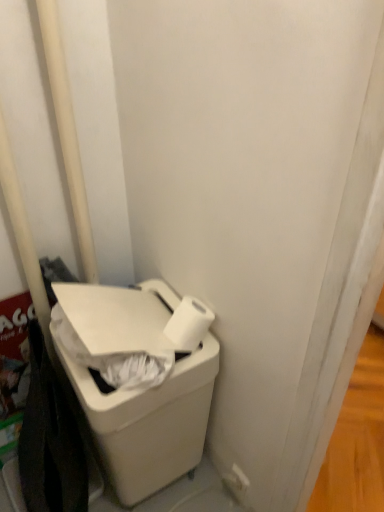
The image size is (384, 512). Find the location of `white matte toilet paper at lower right`. white matte toilet paper at lower right is located at coordinates (189, 324).

This screenshot has width=384, height=512. Describe the element at coordinates (138, 386) in the screenshot. I see `white plastic waste container at lower left` at that location.

This screenshot has width=384, height=512. Identify the location of white matte toilet paper at lower right. (189, 324).

Do you think white matte toilet paper at lower right is within white plastic pole at left, or outside of it?

white matte toilet paper at lower right is not enclosed by white plastic pole at left.

Considering the relative sizes of white matte toilet paper at lower right and white plastic pole at left in the image provided, is white matte toilet paper at lower right bigger than white plastic pole at left?

No.

Between point (174, 325) and point (68, 153), which one is positioned behind?

The point (68, 153) is more distant.

Is white matte toilet paper at lower right aimed at white plastic pole at left?

No, white matte toilet paper at lower right is not aimed at white plastic pole at left.

Looking at the image, does white plastic pole at left seem bigger or smaller compared to white plastic waste container at lower left?

white plastic pole at left is smaller than white plastic waste container at lower left.

Does point (73, 140) appear closer or farther from the camera than point (183, 367)?

Point (73, 140) is farther from the camera than point (183, 367).

Considering the sizes of white plastic pole at left and white plastic waste container at lower left in the image, is white plastic pole at left wider or thinner than white plastic waste container at lower left?

In the image, white plastic pole at left appears to be more narrow than white plastic waste container at lower left.

From the image's perspective, is white plastic pole at left located above or below white plastic waste container at lower left?

white plastic pole at left is situated higher than white plastic waste container at lower left in the image.

From a real-world perspective, who is located higher, white plastic waste container at lower left or white plastic pole at left?

white plastic pole at left, from a real-world perspective.

How many degrees apart are the facing directions of white plastic waste container at lower left and white plastic pole at left?

The angular difference between white plastic waste container at lower left and white plastic pole at left is 90 degrees.

From the image's perspective, is white plastic waste container at lower left positioned above or below white plastic pole at left?

Clearly, from the image's perspective, white plastic waste container at lower left is below white plastic pole at left.

Can you confirm if white plastic waste container at lower left is wider than white plastic pole at left?

Yes.

Is point (166, 335) positioned before point (57, 352)?

Yes, point (166, 335) is in front of point (57, 352).

Is white matte toilet paper at lower right surrounding white plastic waste container at lower left?

No, white matte toilet paper at lower right does not contain white plastic waste container at lower left.

Where is `toilet paper on the right of white plastic waste container at lower left`? The image size is (384, 512). toilet paper on the right of white plastic waste container at lower left is located at coordinates (189, 324).

From a real-world perspective, is white matte toilet paper at lower right beneath white plastic waste container at lower left?

No, from a real-world perspective, white matte toilet paper at lower right is not beneath white plastic waste container at lower left.

At what (x,y) coordinates should I click in order to perform the action: click on pole above the white matte toilet paper at lower right (from the image's perspective). Please return your answer as a coordinate pair (x, y). The height and width of the screenshot is (512, 384). Looking at the image, I should click on (67, 133).

From a real-world perspective, is white plastic pole at left positioned above or below white matte toilet paper at lower right?

Clearly, from a real-world perspective, white plastic pole at left is above white matte toilet paper at lower right.

Is white plastic pole at left positioned beyond the bounds of white matte toilet paper at lower right?

Absolutely, white plastic pole at left is external to white matte toilet paper at lower right.

From a real-world perspective, is white plastic waste container at lower left physically located above or below white matte toilet paper at lower right?

In terms of real-world spatial position, white plastic waste container at lower left is below white matte toilet paper at lower right.

Would you say white plastic waste container at lower left contains white matte toilet paper at lower right?

Yes.

How different are the orientations of white plastic waste container at lower left and white matte toilet paper at lower right in degrees?

The angle between the facing direction of white plastic waste container at lower left and the facing direction of white matte toilet paper at lower right is 0.00185 degrees.

Is the position of white plastic waste container at lower left less distant than that of white matte toilet paper at lower right?

Yes, the depth of white plastic waste container at lower left is less than that of white matte toilet paper at lower right.

Locate an element on the screen. This screenshot has height=512, width=384. toilet paper located underneath the white plastic pole at left (from a real-world perspective) is located at coordinates (189, 324).

Where is `waste container on the right of white plastic pole at left`? This screenshot has height=512, width=384. waste container on the right of white plastic pole at left is located at coordinates (138, 386).

Which object lies nearer to the anchor point white plastic pole at left, white plastic waste container at lower left or white matte toilet paper at lower right?

white plastic waste container at lower left is positioned closer to the anchor white plastic pole at left.

Which object lies further to the anchor point white matte toilet paper at lower right, white plastic pole at left or white plastic waste container at lower left?

white plastic pole at left lies further to white matte toilet paper at lower right than the other object.

Based on their spatial positions, is white matte toilet paper at lower right or white plastic waste container at lower left further from white plastic pole at left?

Among the two, white matte toilet paper at lower right is located further to white plastic pole at left.

From the image, which object appears to be farther from white plastic waste container at lower left, white plastic pole at left or white matte toilet paper at lower right?

white plastic pole at left is positioned further to the anchor white plastic waste container at lower left.

When comparing their distances from white plastic waste container at lower left, does white matte toilet paper at lower right or white plastic pole at left seem closer?

white matte toilet paper at lower right is positioned closer to the anchor white plastic waste container at lower left.

Looking at the image, which one is located further to white matte toilet paper at lower right, white plastic waste container at lower left or white plastic pole at left?

Based on the image, white plastic pole at left appears to be further to white matte toilet paper at lower right.

In order to click on toilet paper that lies between white plastic pole at left and white plastic waste container at lower left from top to bottom in this screenshot , I will do `click(189, 324)`.